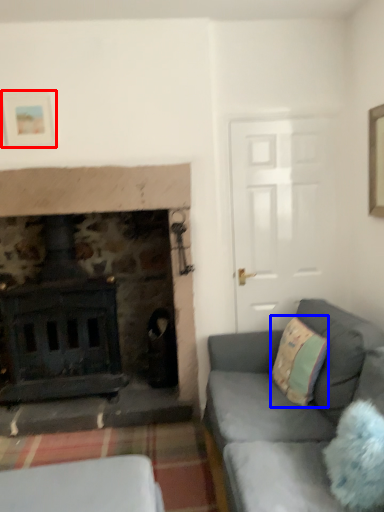
Question: Which point is closer to the camera, picture frame (highlighted by a red box) or throw pillow (highlighted by a blue box)?

Choices:
 (A) picture frame
 (B) throw pillow

Answer: (B)